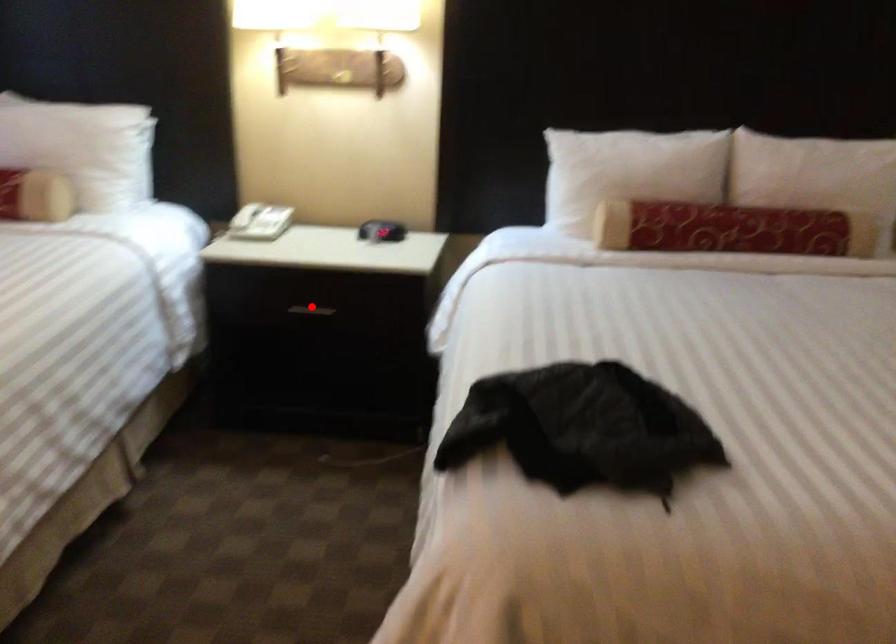
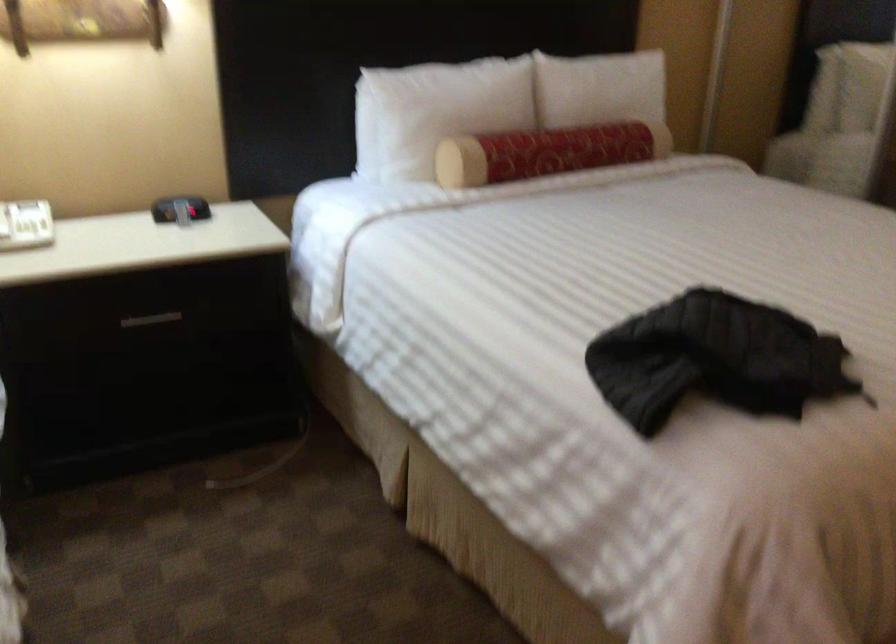
Find the pixel in the second image that matches the highlighted location in the first image.

(151, 319)